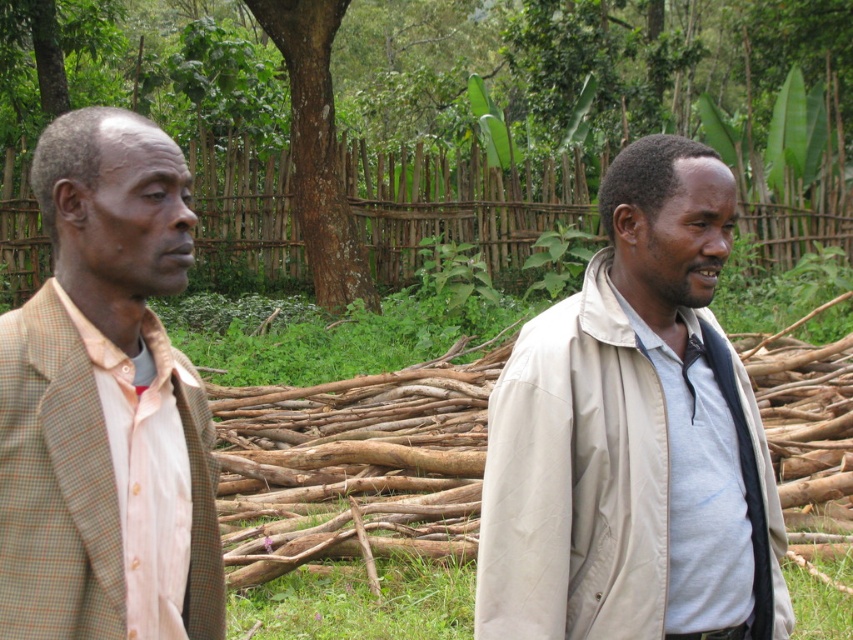
Question: Which object is the farthest from the beige fabric jacket at right?

Choices:
 (A) brown rough bark tree at center
 (B) light brown checkered blazer at left

Answer: (A)

Question: Among these objects, which one is farthest from the camera?

Choices:
 (A) light brown checkered blazer at left
 (B) beige fabric jacket at right
 (C) brown rough bark tree at center

Answer: (C)

Question: Which point is closer to the camera?

Choices:
 (A) (329, 234)
 (B) (323, 120)

Answer: (B)

Question: Does light brown checkered blazer at left appear on the right side of brown rough bark tree at center?

Choices:
 (A) yes
 (B) no

Answer: (A)

Question: Can you confirm if beige fabric jacket at right is wider than brown rough bark tree at center?

Choices:
 (A) yes
 (B) no

Answer: (B)

Question: Considering the relative positions of beige fabric jacket at right and light brown checkered blazer at left in the image provided, where is beige fabric jacket at right located with respect to light brown checkered blazer at left?

Choices:
 (A) above
 (B) below

Answer: (B)